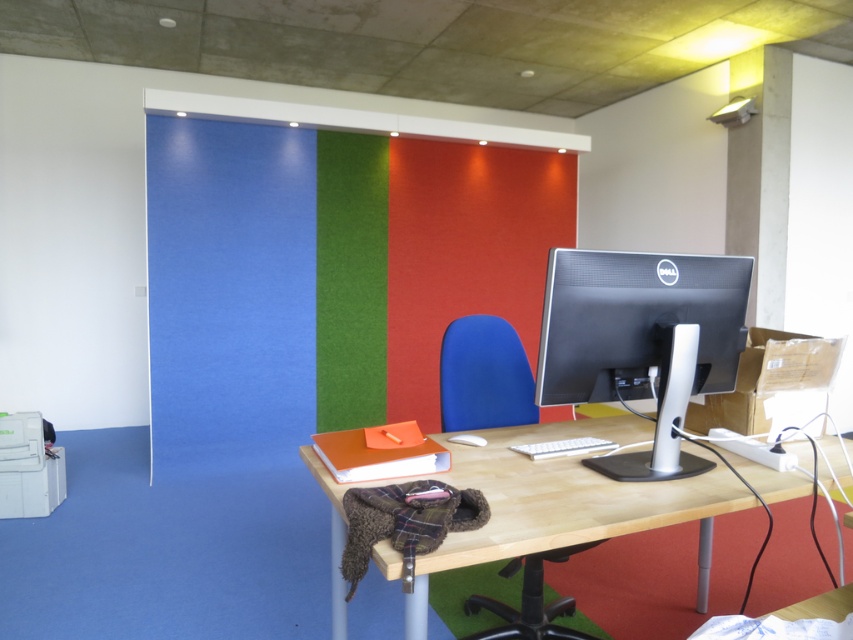
Question: Is the position of light wood/woodendesk at center less distant than that of sleek silver monitor at center?

Choices:
 (A) yes
 (B) no

Answer: (A)

Question: Is light wood/woodendesk at center bigger than sleek silver monitor at center?

Choices:
 (A) yes
 (B) no

Answer: (A)

Question: Is light wood/woodendesk at center above blue fabric chair at center?

Choices:
 (A) no
 (B) yes

Answer: (B)

Question: Which point is closer to the camera?

Choices:
 (A) (570, 275)
 (B) (339, 538)
 (C) (447, 417)

Answer: (A)

Question: Considering the real-world distances, which object is closest to the sleek silver monitor at center?

Choices:
 (A) blue fabric chair at center
 (B) light wood/woodendesk at center

Answer: (B)

Question: Which object appears closest to the camera in this image?

Choices:
 (A) light wood/woodendesk at center
 (B) sleek silver monitor at center
 (C) blue fabric chair at center

Answer: (A)